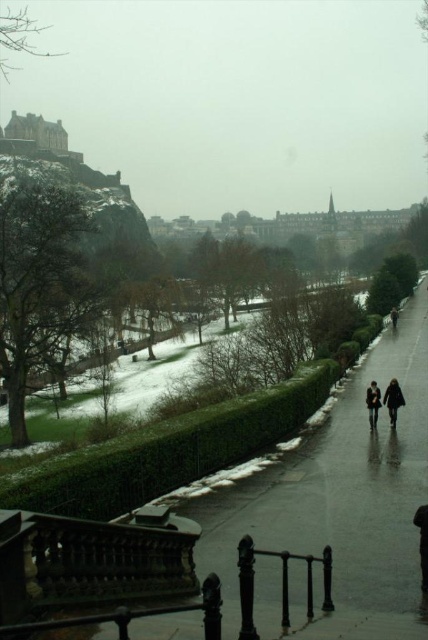
Question: Where is dark fabric coat at center located in relation to dark brown leather jacket at lower right in the image?

Choices:
 (A) left
 (B) right

Answer: (A)

Question: Does dark gray coat at center have a greater width compared to dark gray coat at lower right?

Choices:
 (A) no
 (B) yes

Answer: (B)

Question: Is dark gray coat at lower right to the right of dark brown leather jacket at lower right from the viewer's perspective?

Choices:
 (A) yes
 (B) no

Answer: (B)

Question: Which object is closer to the camera taking this photo?

Choices:
 (A) dark gray coat at center
 (B) dark brown leather coat at lower center

Answer: (B)

Question: Which point appears farthest from the camera in this image?

Choices:
 (A) pos(374,420)
 (B) pos(425,582)
 (C) pos(395,328)

Answer: (C)

Question: Among these objects, which one is farthest from the camera?

Choices:
 (A) dark fabric coat at center
 (B) dark brown leather coat at lower center

Answer: (A)